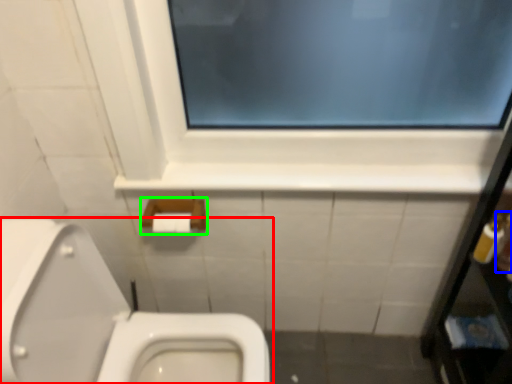
Question: Considering the real-world distances, which object is farthest from toilet (highlighted by a red box)? toiletry (highlighted by a blue box) or towel bar (highlighted by a green box)?

Choices:
 (A) toiletry
 (B) towel bar

Answer: (A)